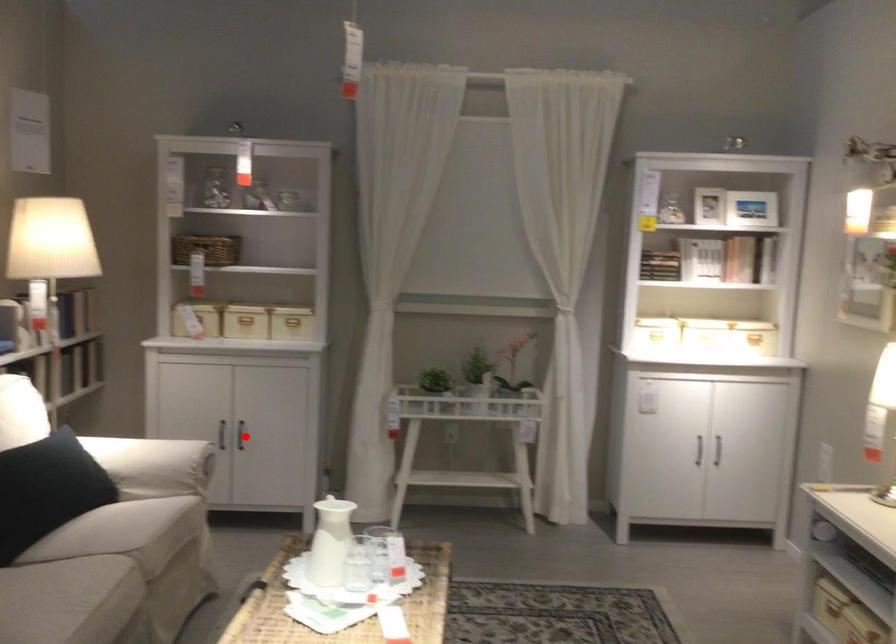
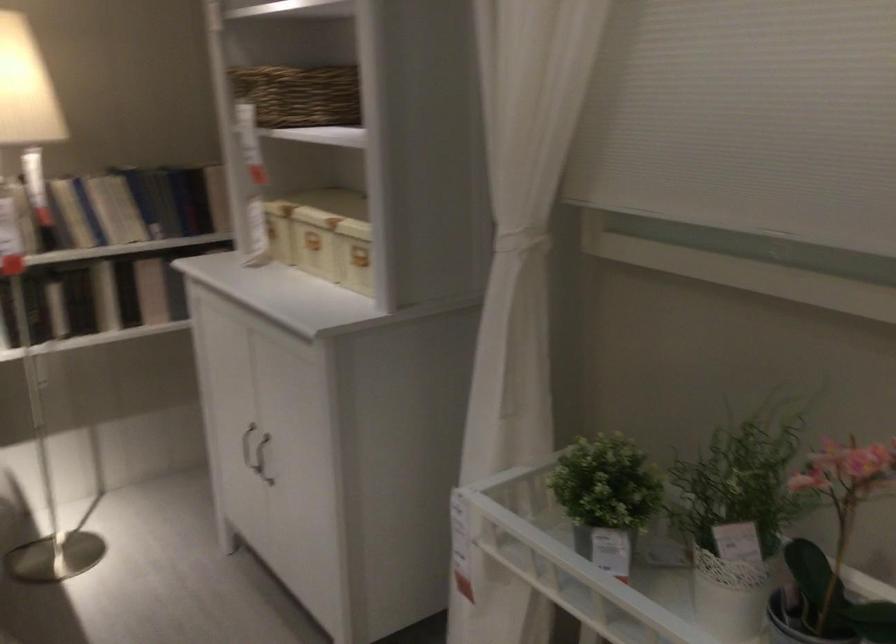
Question: I am providing you with two images of the same scene from different viewpoints. A red point is shown in image1. For the corresponding object point in image2, is it positioned nearer or farther from the camera?

Choices:
 (A) Nearer
 (B) Farther

Answer: (A)